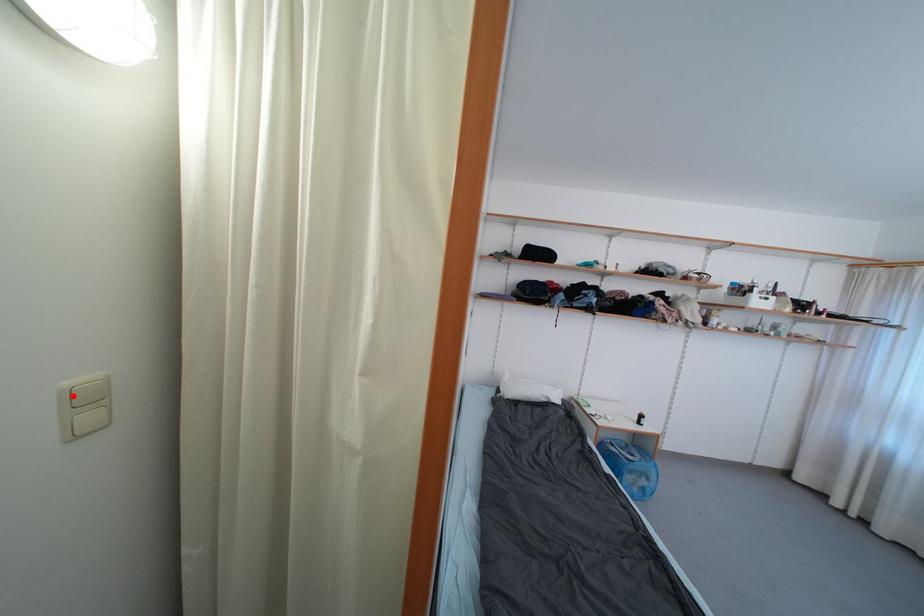
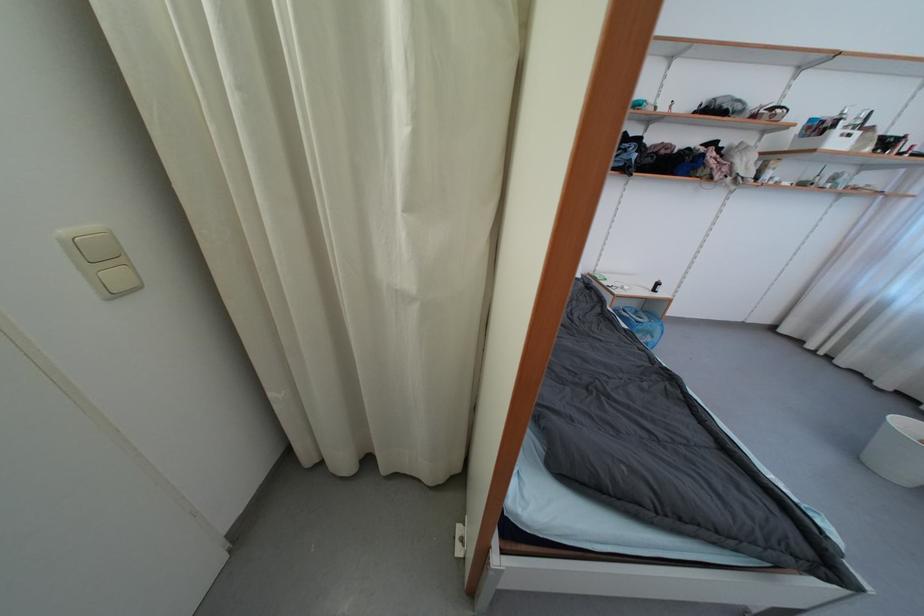
The point at the highlighted location is marked in the first image. Where is the corresponding point in the second image?

(79, 246)